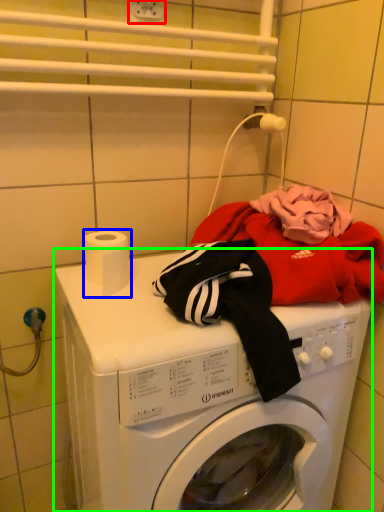
Question: Based on their relative distances, which object is farther from electric outlet (highlighted by a red box)? Choose from toilet paper (highlighted by a blue box) and washing machine (highlighted by a green box).

Choices:
 (A) toilet paper
 (B) washing machine

Answer: (B)